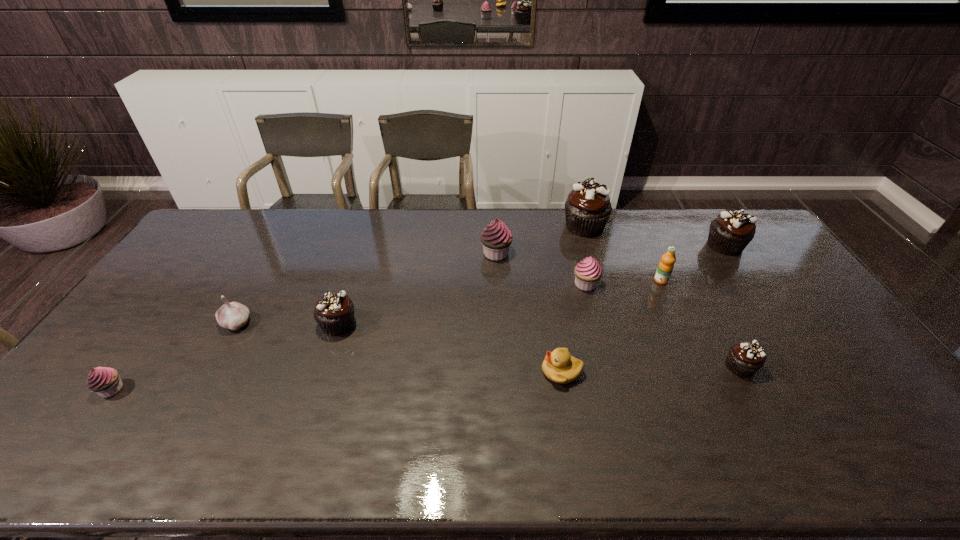
Locate an element on the screen. empty space that is in between the fifth cupcake from right to left and the ninth object from left to right is located at coordinates (618, 310).

In order to click on vacant space that's between the second cupcake from right to left and the biggest brown cupcake in this screenshot , I will do `click(662, 296)`.

Find the location of a particular element. Image resolution: width=960 pixels, height=540 pixels. vacant area that lies between the ninth object from left to right and the fifth object from left to right is located at coordinates (651, 369).

At what (x,y) coordinates should I click in order to perform the action: click on empty location between the fourth object from left to right and the garlic. Please return your answer as a coordinate pair (x, y). This screenshot has height=540, width=960. Looking at the image, I should click on (367, 288).

The width and height of the screenshot is (960, 540). Find the location of `unoccupied area between the seventh object from right to left and the nearest pink cupcake`. unoccupied area between the seventh object from right to left and the nearest pink cupcake is located at coordinates (304, 321).

Image resolution: width=960 pixels, height=540 pixels. I want to click on empty location between the leftmost cupcake and the nearest brown cupcake, so point(426,378).

You are a GUI agent. You are given a task and a screenshot of the screen. Output one action in this format:
    pyautogui.click(x=<x>, y=<y>)
    Task: Click on the free space between the biggest brown cupcake and the third smallest brown cupcake
    Image resolution: width=960 pixels, height=540 pixels.
    Given the screenshot: What is the action you would take?
    pyautogui.click(x=655, y=236)

In order to click on empty space that is in between the fourth nearest cupcake and the duckling in this screenshot , I will do (x=573, y=328).

I want to click on vacant point located between the second object from left to right and the duckling, so click(399, 347).

Locate which object is the fourth closest to the fifth farthest cupcake. Please provide its 2D coordinates. Your answer should be formatted as a tuple, i.e. [(x, y)], where the tuple contains the x and y coordinates of a point satisfying the conditions above.

[(559, 366)]